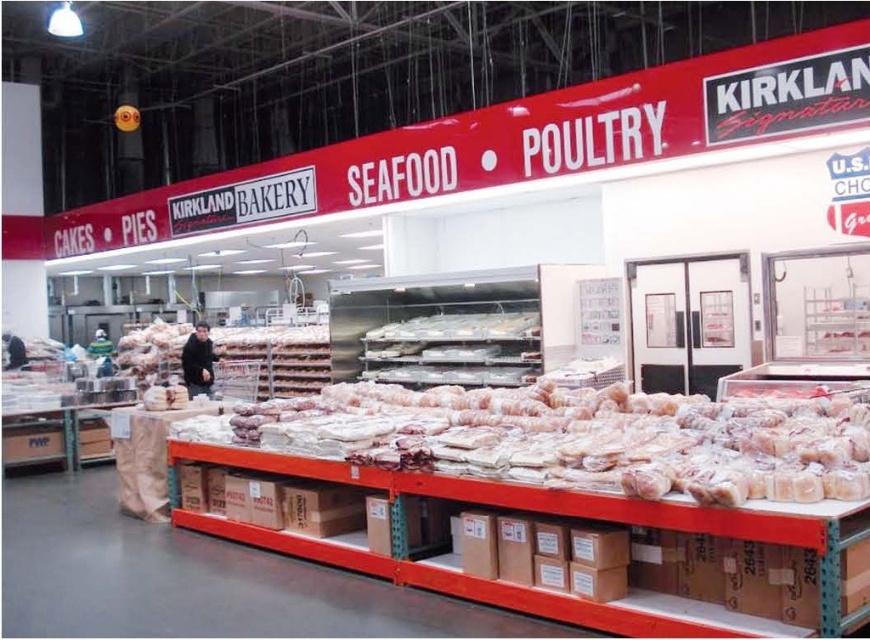
You are a customer at Costco looking for the Kirkland Signature baguette. You see the translucent plastic baguette at center and the white plastic trays at center. Which item is located below the other?

The translucent plastic baguette at center is positioned under the white plastic trays at center, so it is located below the white plastic trays at center.

Based on the photo, you are standing in the Costco Kirkland Signature bakery section and see two points marked in the scene. Which point, point [474,392] or point [420,336], is closer to you?

Point [474,392] is closer to the camera than point [420,336].